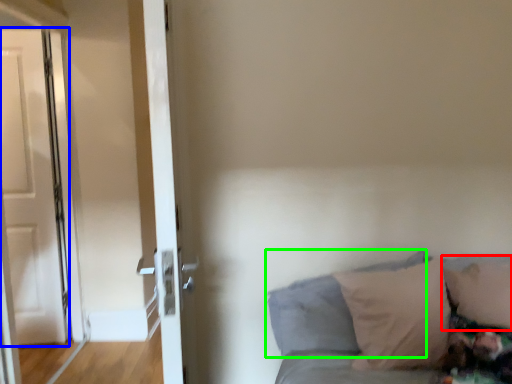
Question: Which object is the closest to the pillow (highlighted by a red box)? Choose among these: door (highlighted by a blue box) or pillow (highlighted by a green box).

Choices:
 (A) door
 (B) pillow

Answer: (B)